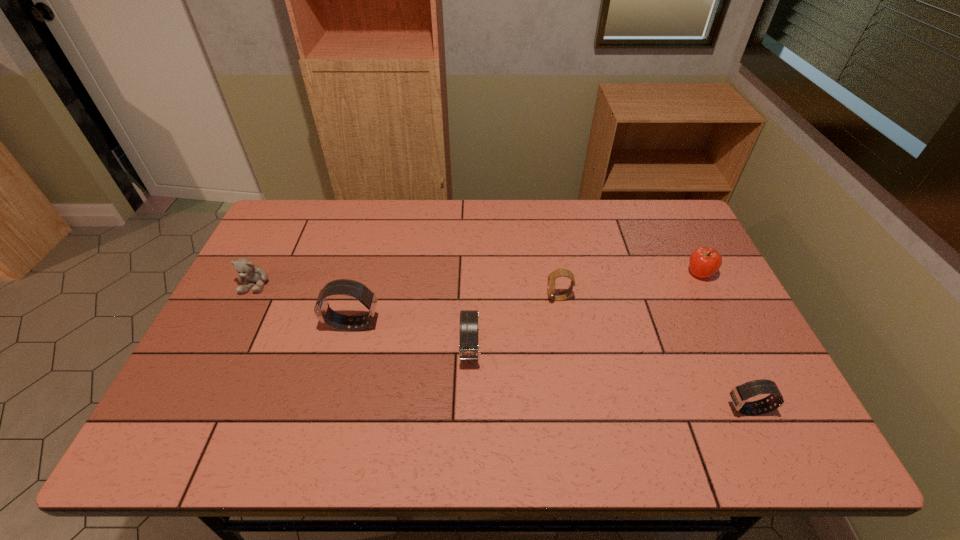
This screenshot has width=960, height=540. Identify the location of vacant space at the right edge of the desktop. (723, 377).

Image resolution: width=960 pixels, height=540 pixels. In the image, there is a desktop. What are the coordinates of `vacant area at the near left corner` in the screenshot? It's located at (180, 389).

This screenshot has width=960, height=540. Identify the location of free space at the far right corner of the desktop. (638, 208).

You are a GUI agent. You are given a task and a screenshot of the screen. Output one action in this format:
    pyautogui.click(x=<x>, y=<y>)
    Task: Click on the vacant space in between the apple and the tallest watch
    This screenshot has height=540, width=960.
    Given the screenshot: What is the action you would take?
    pyautogui.click(x=525, y=299)

The height and width of the screenshot is (540, 960). Find the location of `empty space that is in between the teddy bear and the third object from right to left`. empty space that is in between the teddy bear and the third object from right to left is located at coordinates (408, 291).

Locate an element on the screen. The height and width of the screenshot is (540, 960). free spot between the teddy bear and the nearest watch is located at coordinates point(501,347).

The image size is (960, 540). What are the coordinates of `vacant space in between the teddy bear and the tallest watch` in the screenshot? It's located at (303, 304).

At what (x,y) coordinates should I click in order to perform the action: click on empty space between the rightmost watch and the apple. Please return your answer as a coordinate pair (x, y). This screenshot has width=960, height=540. Looking at the image, I should click on (723, 342).

Where is `vacant space that is in between the teddy bear and the third object from right to left`? The image size is (960, 540). vacant space that is in between the teddy bear and the third object from right to left is located at coordinates (408, 291).

Where is `blank region between the apple and the leftmost watch`? This screenshot has width=960, height=540. blank region between the apple and the leftmost watch is located at coordinates (525, 299).